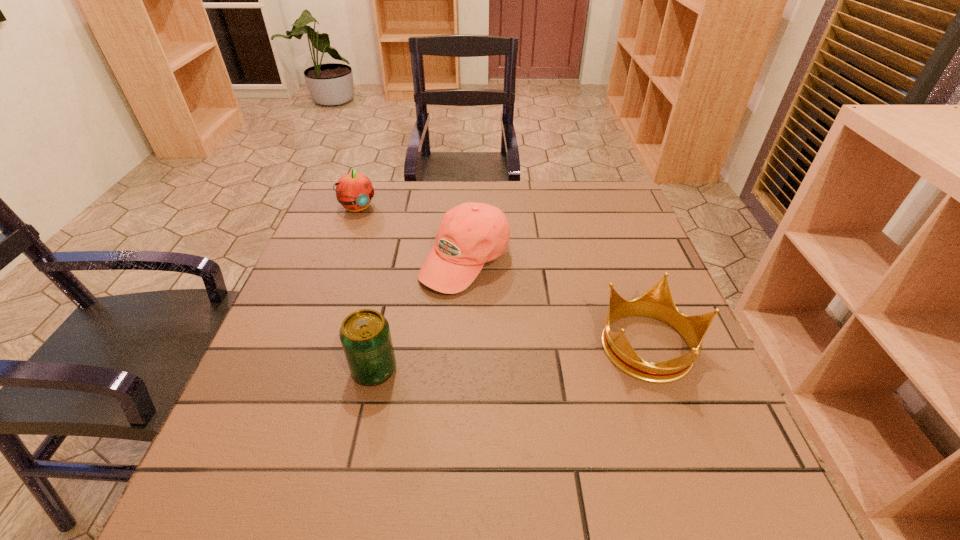
You are a GUI agent. You are given a task and a screenshot of the screen. Output one action in this format:
    pyautogui.click(x=<x>, y=<y>)
    Task: Click on the third object from right to left
    The width and height of the screenshot is (960, 540).
    Given the screenshot: What is the action you would take?
    pyautogui.click(x=365, y=336)

Locate an element on the screen. crown is located at coordinates (657, 302).

At what (x,y) coordinates should I click in order to perform the action: click on the farthest object. Please return your answer as a coordinate pair (x, y). Looking at the image, I should click on (354, 191).

At what (x,y) coordinates should I click in order to perform the action: click on the leftmost object. Please return your answer as a coordinate pair (x, y). Looking at the image, I should click on (354, 191).

Find the location of a particular element. baseball cap is located at coordinates (470, 234).

Identify the location of the third nearest object. (470, 234).

Locate an element on the screen. The width and height of the screenshot is (960, 540). vacant space located on the back of the beer can is located at coordinates (390, 297).

The width and height of the screenshot is (960, 540). In order to click on free space located 0.240m on the back of the crown in this screenshot , I will do `click(613, 245)`.

Identify the location of vacant space located on the surface of the farthest object. Image resolution: width=960 pixels, height=540 pixels. (382, 233).

The height and width of the screenshot is (540, 960). What are the coordinates of `vacant space located on the surface of the farthest object` in the screenshot? It's located at (407, 259).